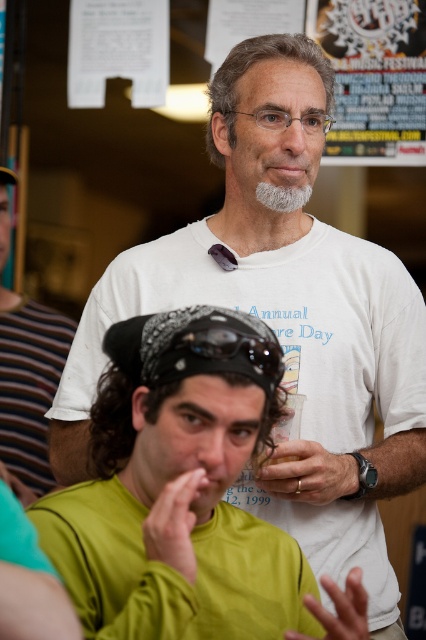
Who is more forward, (227, 344) or (302, 189)?

Point (227, 344)

Where is `green matte shirt at center`? green matte shirt at center is located at coordinates (184, 493).

Can you confirm if gray hair at upper center is thinner than gray matte beard at center?

No, gray hair at upper center is not thinner than gray matte beard at center.

Which is in front, point (213, 156) or point (256, 193)?

Point (256, 193) is in front.

I want to click on gray hair at upper center, so click(252, 65).

From the picture: Can you confirm if black textured goggles at center is positioned below gray matte beard at center?

Yes.

Is point (201, 349) farther from viewer compared to point (259, 189)?

No, it is not.

Identify the location of black textured goggles at center. (235, 348).